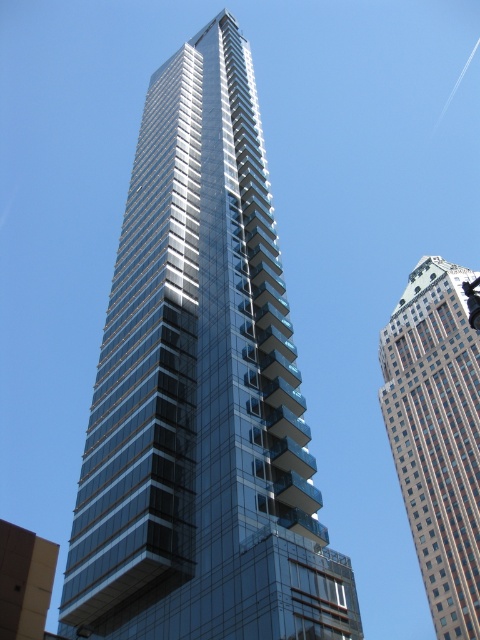
Question: Can you confirm if glassy metallic skyscraper at center is thinner than brown brick building at upper right?

Choices:
 (A) no
 (B) yes

Answer: (B)

Question: Which object is closer to the camera taking this photo?

Choices:
 (A) brown brick building at upper right
 (B) glassy metallic skyscraper at center

Answer: (B)

Question: Does glassy metallic skyscraper at center have a larger size compared to brown brick building at upper right?

Choices:
 (A) no
 (B) yes

Answer: (B)

Question: Which point appears closest to the camera in this image?

Choices:
 (A) (139, 372)
 (B) (386, 412)

Answer: (A)

Question: In this image, where is glassy metallic skyscraper at center located relative to brown brick building at upper right?

Choices:
 (A) above
 (B) below

Answer: (A)